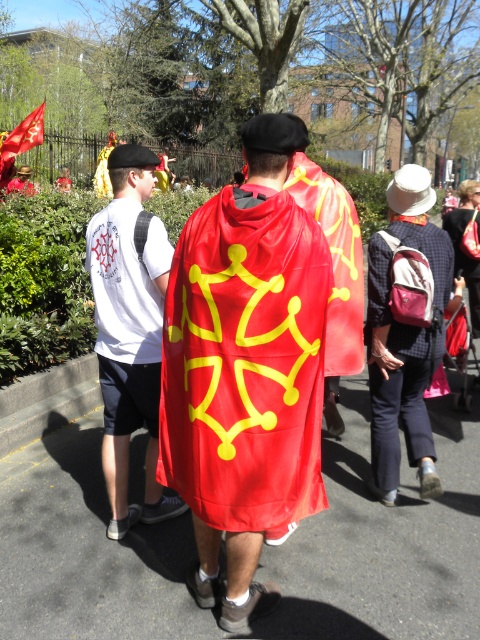
Is red satin cape at center to the left of red fabric flag at upper left from the viewer's perspective?

In fact, red satin cape at center is to the right of red fabric flag at upper left.

Can you confirm if red satin cape at center is taller than red fabric flag at upper left?

Correct, red satin cape at center is much taller as red fabric flag at upper left.

Who is more distant from viewer, (460, 211) or (8, 150)?

The point (8, 150) is behind.

Locate an element on the screen. The height and width of the screenshot is (640, 480). red satin cape at center is located at coordinates (465, 259).

Is white t-shirt at left to the right of red satin cape at center from the viewer's perspective?

Incorrect, white t-shirt at left is not on the right side of red satin cape at center.

Can you confirm if white t-shirt at left is smaller than red satin cape at center?

Incorrect, white t-shirt at left is not smaller in size than red satin cape at center.

Between point (111, 536) and point (471, 330), which one is positioned in front?

Point (111, 536) is more forward.

Locate an element on the screen. white t-shirt at left is located at coordinates (130, 330).

How distant is shiny red cape at center from white t-shirt at left?

A distance of 30.44 inches exists between shiny red cape at center and white t-shirt at left.

Can you confirm if shiny red cape at center is taller than white t-shirt at left?

Indeed, shiny red cape at center has a greater height compared to white t-shirt at left.

Measure the distance between point (x=280, y=131) and camera.

The distance of point (x=280, y=131) from camera is 8.78 feet.

The height and width of the screenshot is (640, 480). In order to click on shiny red cape at center in this screenshot , I will do `click(245, 371)`.